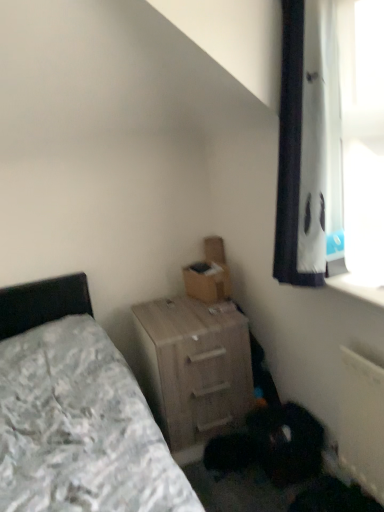
Question: Visually, is light wood nightstand at lower center positioned to the left or to the right of brown cardboard box at center?

Choices:
 (A) right
 (B) left

Answer: (B)

Question: Considering the positions of light wood nightstand at lower center and brown cardboard box at center in the image, is light wood nightstand at lower center taller or shorter than brown cardboard box at center?

Choices:
 (A) tall
 (B) short

Answer: (A)

Question: From a real-world perspective, relative to brown cardboard box at center, is light wood nightstand at lower center vertically above or below?

Choices:
 (A) above
 (B) below

Answer: (B)

Question: Considering the positions of brown cardboard box at center and light wood nightstand at lower center in the image, is brown cardboard box at center wider or thinner than light wood nightstand at lower center?

Choices:
 (A) thin
 (B) wide

Answer: (A)

Question: Which is correct: brown cardboard box at center is inside light wood nightstand at lower center, or outside of it?

Choices:
 (A) outside
 (B) inside

Answer: (A)

Question: Relative to light wood nightstand at lower center, is brown cardboard box at center in front or behind?

Choices:
 (A) behind
 (B) front

Answer: (A)

Question: In terms of size, does brown cardboard box at center appear bigger or smaller than light wood nightstand at lower center?

Choices:
 (A) small
 (B) big

Answer: (A)